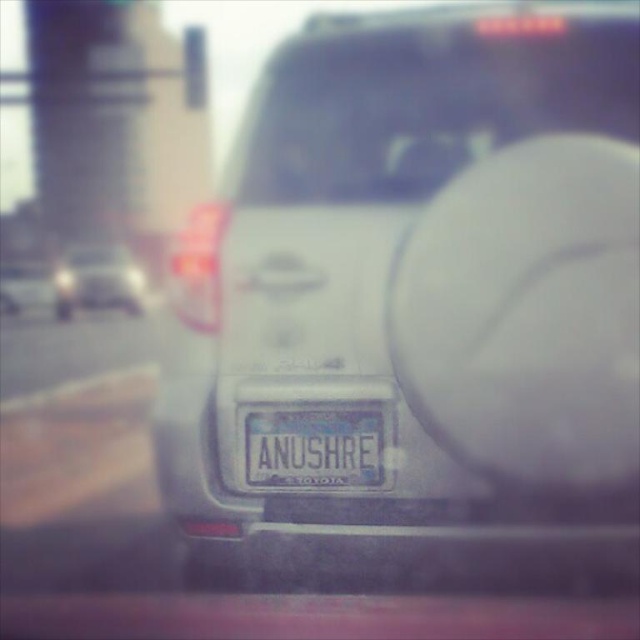
Between transparent glass windshield at center and matte silver car at center, which one appears on the left side from the viewer's perspective?

matte silver car at center

Who is more forward, (x=369, y=60) or (x=134, y=284)?

Point (x=369, y=60) is in front.

Describe the element at coordinates (429, 102) in the screenshot. I see `transparent glass windshield at center` at that location.

Find the location of a particular element. Image resolution: width=640 pixels, height=640 pixels. transparent glass windshield at center is located at coordinates (429, 102).

Can you confirm if satin silver suv at center is positioned below white metallic license plate at center?

Actually, satin silver suv at center is above white metallic license plate at center.

The width and height of the screenshot is (640, 640). In order to click on satin silver suv at center in this screenshot , I will do `click(420, 278)`.

Can you confirm if white metallic license plate at center is shorter than matte silver car at center?

Yes.

Can you confirm if white metallic license plate at center is thinner than matte silver car at center?

Yes.

Describe the element at coordinates (316, 445) in the screenshot. I see `white metallic license plate at center` at that location.

At what (x,y) coordinates should I click in order to perform the action: click on white metallic license plate at center. Please return your answer as a coordinate pair (x, y). The image size is (640, 640). Looking at the image, I should click on click(316, 445).